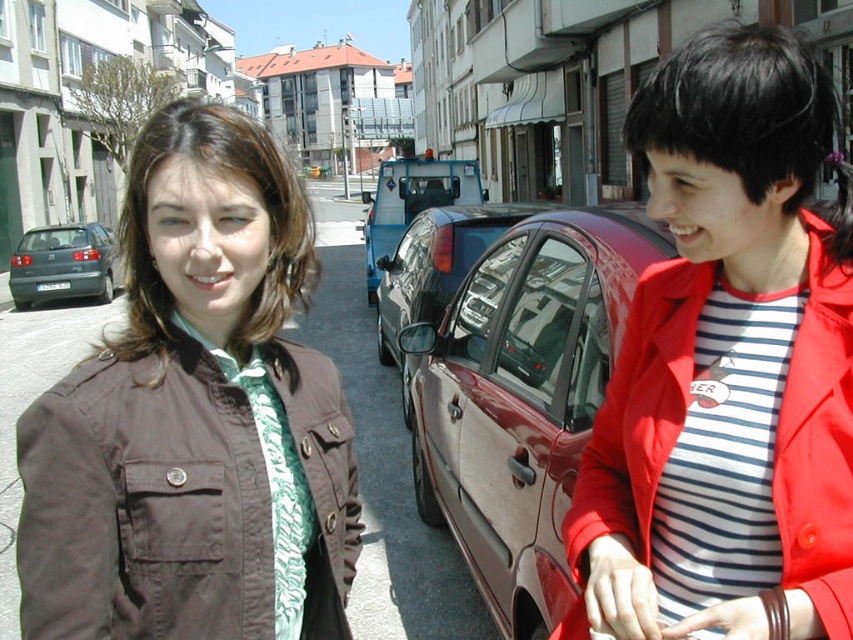
You are a delivery person with a cart that is 2 meters wide. You need to move from the red matte coat at right to the glossy black car at center. Is there enough space between them for your cart to pass through?

The distance between the red matte coat at right and the glossy black car at center is 4.61 meters. Since your cart is 2 meters wide, there is sufficient space for it to pass through.

You are a photographer standing at the center of the street. You want to take a photo that includes both the point at (107,296) and the point at (440,163). Which point should you focus on first to ensure both are in focus?

You should focus on the point at (440,163) first because it is closer to you than the point at (107,296), ensuring both will be in focus when using depth of field.

You are a delivery driver who needs to park your truck next to the matte green car at left and the blue metallic van at center. Which vehicle should you park next to to ensure enough space for your truck?

The blue metallic van at center is larger than the matte green car at left, so parking next to the blue metallic van at center would provide more space for your truck.